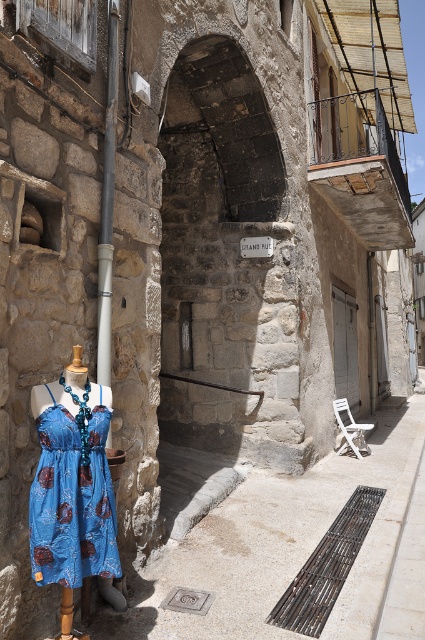
Which of these two, rusty metal grate at lower center or smooth gray pipe at center-left, stands taller?

smooth gray pipe at center-left is taller.

Find the location of a particular element. This screenshot has width=425, height=640. rusty metal grate at lower center is located at coordinates (326, 566).

Does point (57, 545) come farther from viewer compared to point (359, 528)?

No, it is in front of (359, 528).

Where is `blue printed fabric dress at left`? The width and height of the screenshot is (425, 640). blue printed fabric dress at left is located at coordinates (73, 493).

Which is in front, point (90, 420) or point (294, 630)?

Point (90, 420) is more forward.

Find the location of a particular element. blue printed fabric dress at left is located at coordinates (73, 493).

Between point (59, 387) and point (107, 195), which one is positioned behind?

Positioned behind is point (107, 195).

Does point (93, 483) come in front of point (102, 364)?

That is True.

Identify the location of blue printed fabric dress at left. The height and width of the screenshot is (640, 425). (73, 493).